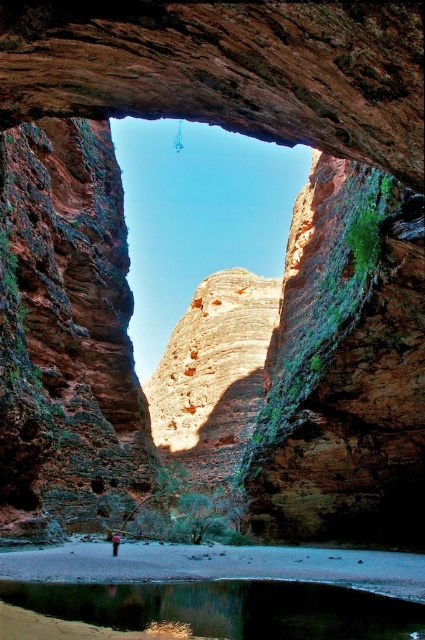
Question: Does green reflective water at lower center have a lesser width compared to pink fabric person at center?

Choices:
 (A) no
 (B) yes

Answer: (A)

Question: Is green reflective water at lower center wider than pink fabric person at center?

Choices:
 (A) no
 (B) yes

Answer: (B)

Question: Is green reflective water at lower center wider than pink fabric person at center?

Choices:
 (A) no
 (B) yes

Answer: (B)

Question: Which of the following is the closest to the observer?

Choices:
 (A) (405, 625)
 (B) (116, 548)

Answer: (A)

Question: Which object appears closest to the camera in this image?

Choices:
 (A) pink fabric person at center
 (B) green reflective water at lower center

Answer: (B)